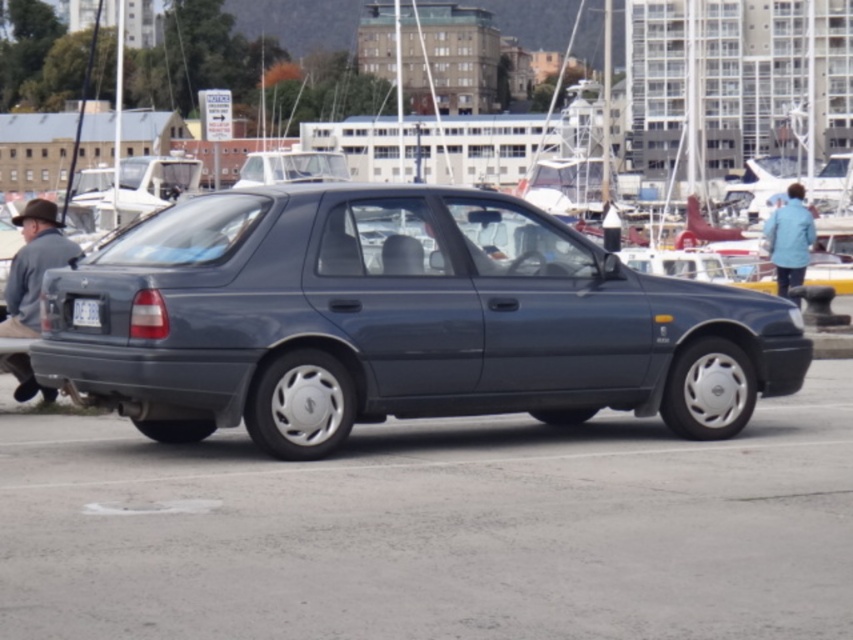
Question: Does satin dark blue sedan at center have a smaller size compared to brown fabric hat at left?

Choices:
 (A) no
 (B) yes

Answer: (A)

Question: Which point is closer to the camera?

Choices:
 (A) light blue fabric jacket at upper right
 (B) white plastic license plate at center
 (C) brown fabric hat at left
 (D) satin dark blue sedan at center

Answer: (D)

Question: Which point is farther to the camera?

Choices:
 (A) brown fabric hat at left
 (B) white plastic license plate at center

Answer: (A)

Question: Does satin dark blue sedan at center have a greater width compared to brown fabric hat at left?

Choices:
 (A) no
 (B) yes

Answer: (B)

Question: Considering the real-world distances, which object is closest to the satin dark blue sedan at center?

Choices:
 (A) brown fabric hat at left
 (B) white plastic license plate at center
 (C) light blue fabric jacket at upper right

Answer: (B)

Question: Is brown fabric hat at left behind white plastic license plate at center?

Choices:
 (A) no
 (B) yes

Answer: (B)